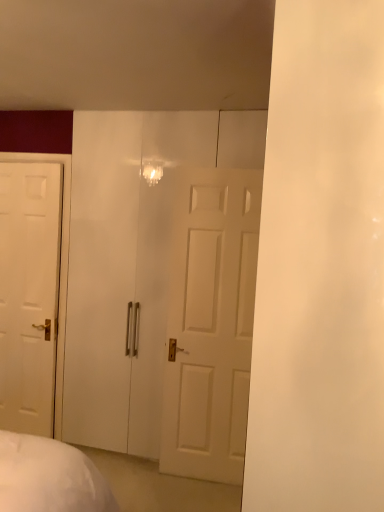
At what (x,y) coordinates should I click in order to perform the action: click on vacant area on top of white glossy door at left (from a real-world perspective). Please return your answer as a coordinate pair (x, y). The width and height of the screenshot is (384, 512). Looking at the image, I should click on (26, 162).